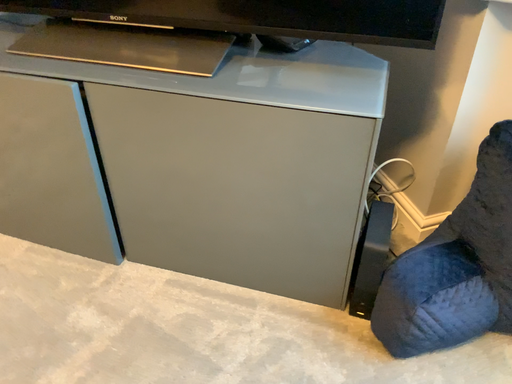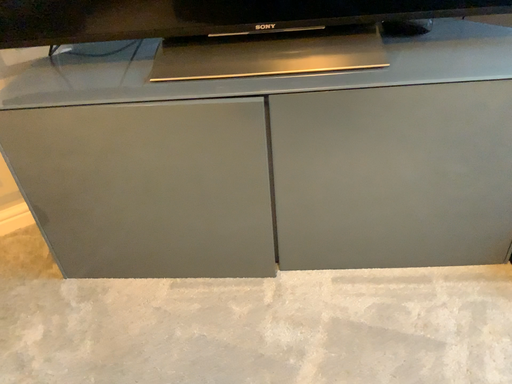
Question: Which way did the camera rotate in the video?

Choices:
 (A) rotated right
 (B) rotated left

Answer: (A)